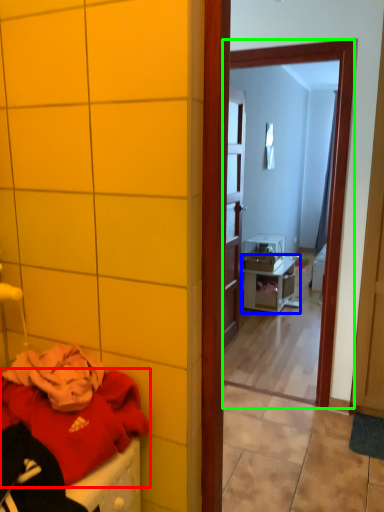
Question: Based on their relative distances, which object is nearer to clothing (highlighted by a red box)? Choose from nightstand (highlighted by a blue box) and mirror (highlighted by a green box).

Choices:
 (A) nightstand
 (B) mirror

Answer: (B)